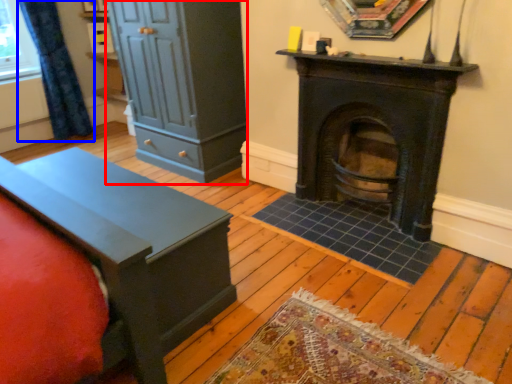
Question: Which of the following is the farthest to the observer, dresser (highlighted by a red box) or curtain (highlighted by a blue box)?

Choices:
 (A) dresser
 (B) curtain

Answer: (B)